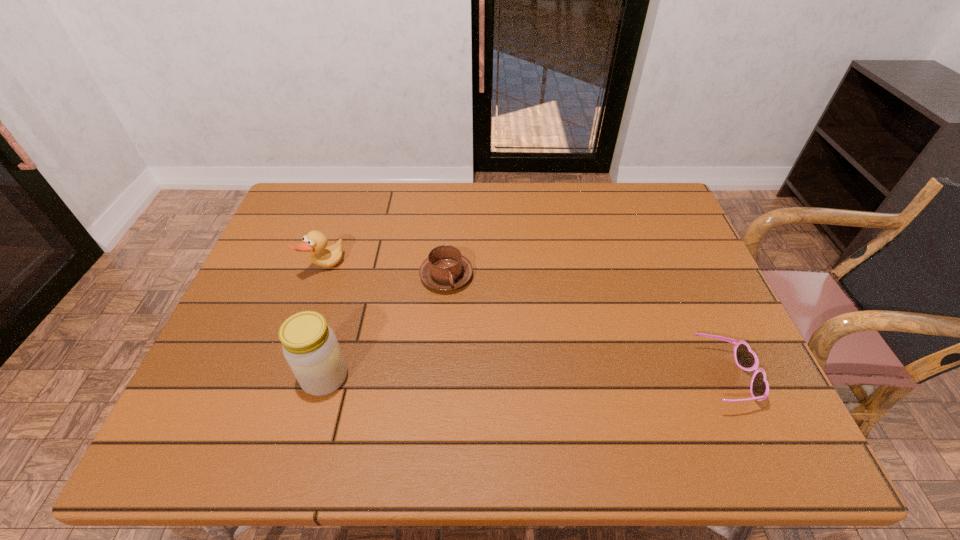
I want to click on vacant space that is in between the second tallest object and the cappuccino, so click(385, 272).

At what (x,y) coordinates should I click in order to perform the action: click on object that stands as the second closest to the jar. Please return your answer as a coordinate pair (x, y). Image resolution: width=960 pixels, height=540 pixels. Looking at the image, I should click on (314, 242).

Locate which object is the third closest to the third object from left to right. Please provide its 2D coordinates. Your answer should be formatted as a tuple, i.e. [(x, y)], where the tuple contains the x and y coordinates of a point satisfying the conditions above.

[(746, 359)]

Identify the location of free space that satisfies the following two spatial constraints: 1. on the front side of the duck; 2. on the left side of the jar. Image resolution: width=960 pixels, height=540 pixels. (286, 377).